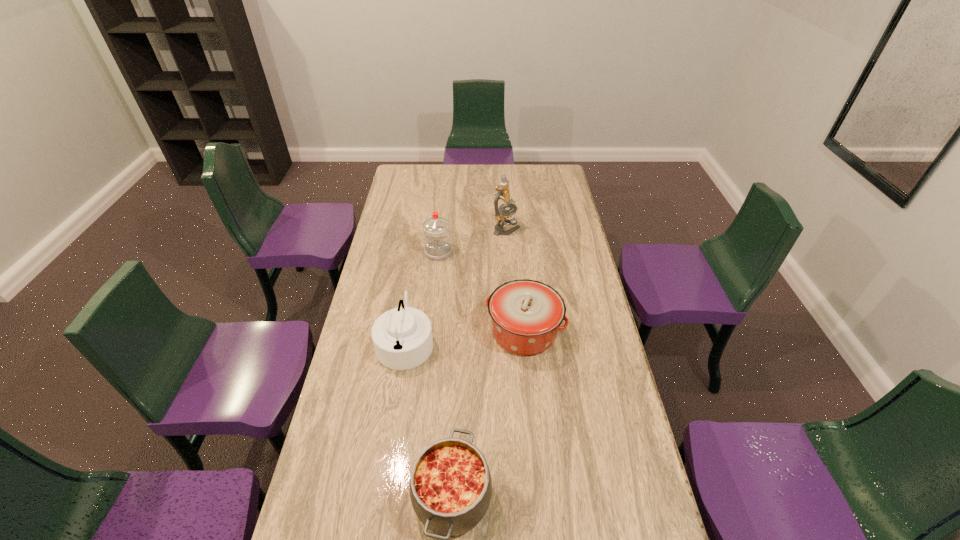
This screenshot has height=540, width=960. I want to click on object that is at the right edge, so click(526, 314).

In the image, there is a desktop. In order to click on blank space at the left edge in this screenshot , I will do `click(396, 208)`.

I want to click on blank space at the right edge, so click(x=615, y=448).

Image resolution: width=960 pixels, height=540 pixels. Find the location of `vacant area at the far left corner`. vacant area at the far left corner is located at coordinates (415, 171).

Where is `free space between the taller casserole and the kettle`? This screenshot has height=540, width=960. free space between the taller casserole and the kettle is located at coordinates (465, 336).

This screenshot has width=960, height=540. I want to click on vacant area between the taller casserole and the fourth nearest object, so click(481, 292).

I want to click on vacant area that lies between the kettle and the farther casserole, so click(x=465, y=336).

You are a GUI agent. You are given a task and a screenshot of the screen. Output one action in this format:
    pyautogui.click(x=<x>, y=<y>)
    Task: Click on the empty location between the second farthest object and the tallest object
    This screenshot has height=540, width=960.
    Given the screenshot: What is the action you would take?
    pyautogui.click(x=472, y=240)

Find the location of a particular element. free space between the kettle and the microscope is located at coordinates (456, 285).

Where is `object that is the closest to the kettle`? This screenshot has height=540, width=960. object that is the closest to the kettle is located at coordinates (526, 314).